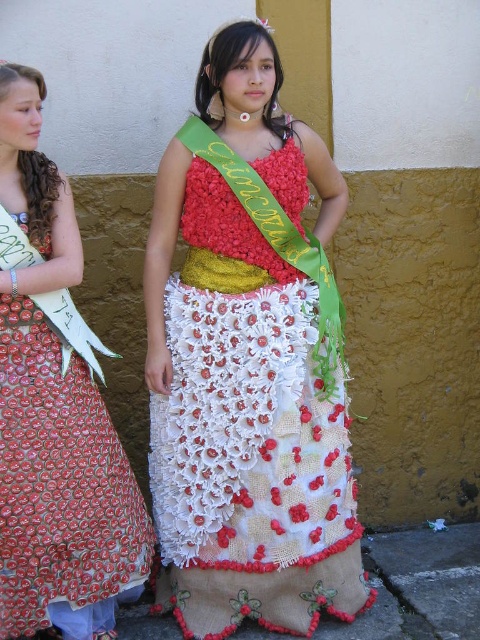
You are a photographer setting up for a photoshoot. You need to position a light source to the right of the textured fabric dress at center and to the left of the red dotted fabric dress at left. Is this possible based on their current positions?

The textured fabric dress at center is to the right of the red dotted fabric dress at left. Therefore, placing a light source to the right of the textured fabric dress at center would also place it to the right of the red dotted fabric dress at left, making it impossible to position the light between them as required.

You are an interior designer planning to place a sofa between the textured fabric dress at center and the red dotted fabric dress at left. Based on their widths, which dress should be positioned closer to the sofa to ensure proper spacing?

The textured fabric dress at center might be wider than the red dotted fabric dress at left, so positioning the wider dress closer to the sofa would allow for adequate spacing between both dresses and the sofa.

You are a photographer setting up for a shoot. You need to ensure both the textured fabric dress at center and the red dotted fabric dress at left are in focus. Which dress should you adjust your camera focus on first to account for their positions?

You should focus on the textured fabric dress at center first because it is closer to you than the red dotted fabric dress at left, ensuring both are in focus by adjusting focus from near to far.